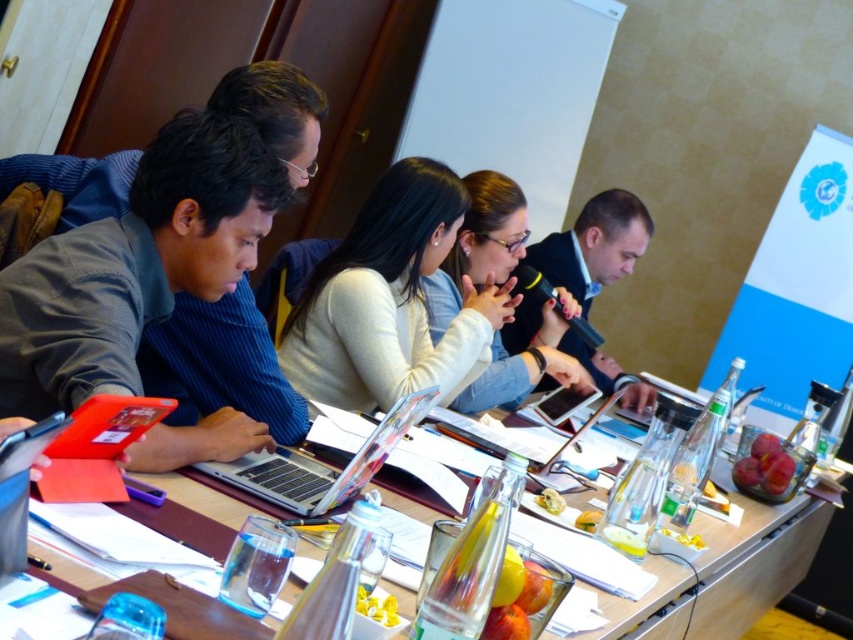
You are standing at the entrance of the conference room and see the white matte jacket at center. If you walk straight towards it, will you reach it before reaching the table in the foreground?

The white matte jacket at center is located at point (x=479, y=244). Since the table is in the foreground, it is closer to the viewer than the jacket. Therefore, you would reach the table first before reaching the white matte jacket at center.

Based on the photo, you are a photographer trying to capture a closeup of the white matte sweater at center and the white matte jacket at center. Since you want to focus on one of them, which one should you choose if you want to avoid blurring the other due to their size difference?

The white matte sweater at center is bigger than the white matte jacket at center. To avoid blurring the other, you should focus on the white matte sweater at center because its larger size will require a more precise focus, ensuring the smaller jacket remains in the frame without needing to adjust the focal length as much.